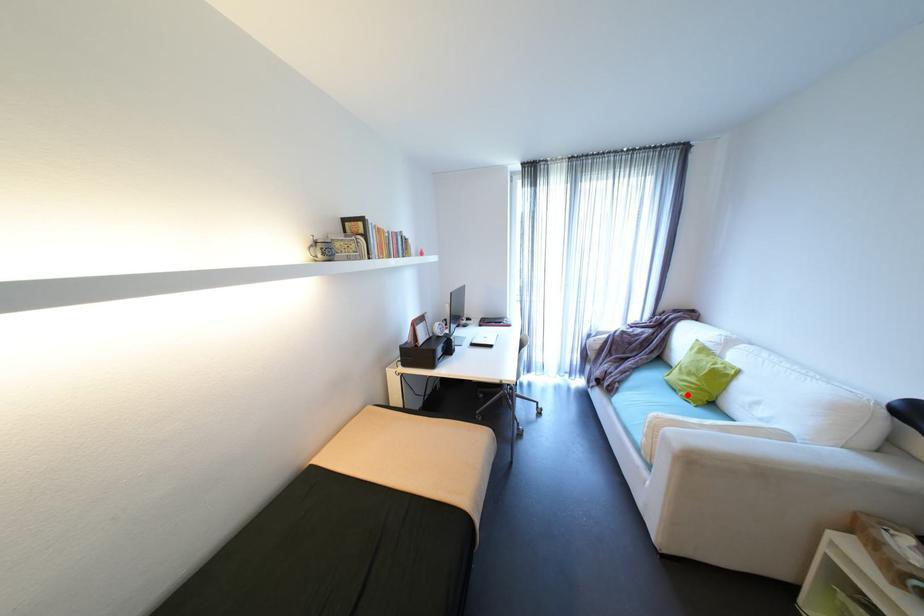
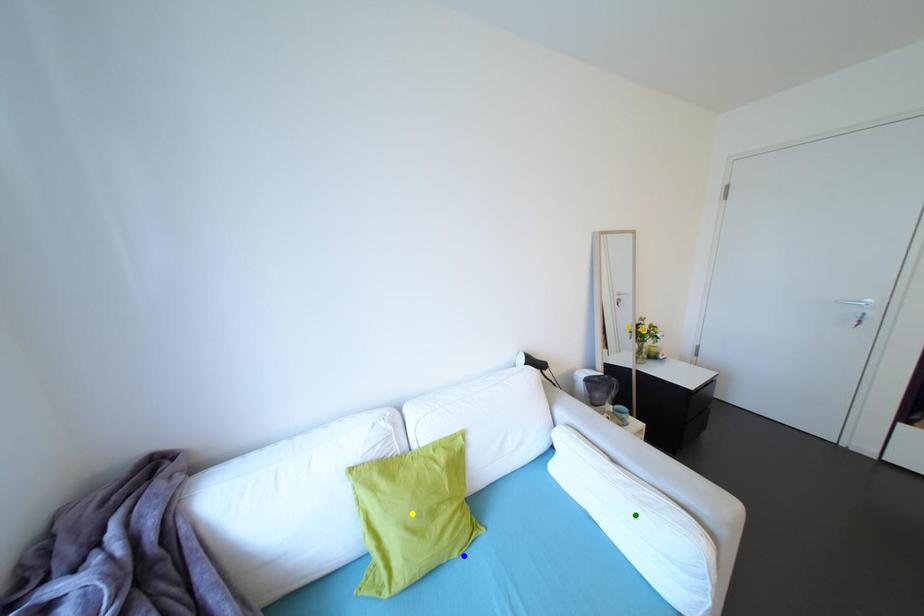
Question: I am providing you with two images of the same scene from different viewpoints. A red point is marked on the first image. You are given multiple points on the second image. Which point in image 2 is actually the same real-world point as the red point in image 1?

Choices:
 (A) yellow point
 (B) blue point
 (C) green point

Answer: (B)